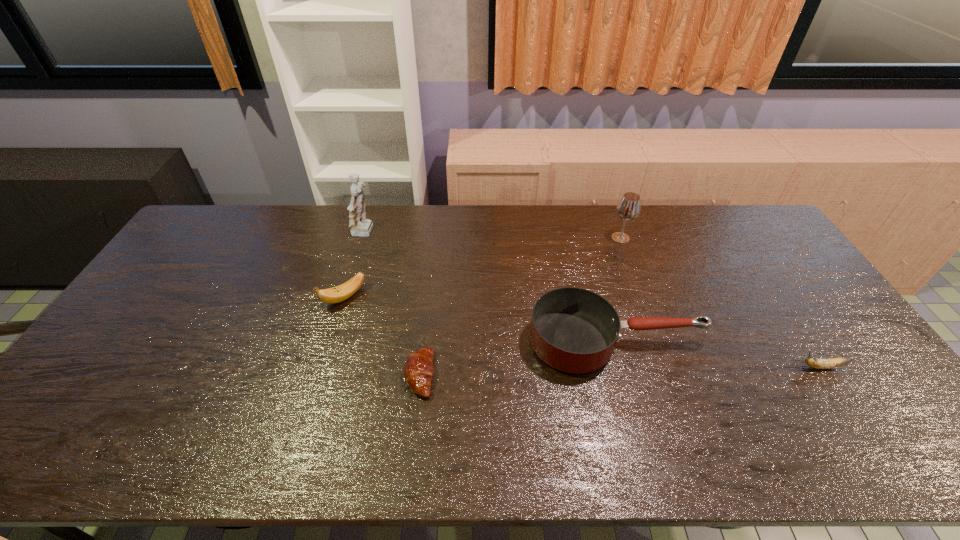
The image size is (960, 540). Find the location of `vacant space at the far edge of the desktop`. vacant space at the far edge of the desktop is located at coordinates (590, 209).

At what (x,y) coordinates should I click in order to perform the action: click on vacant space at the near edge of the desktop. Please return your answer as a coordinate pair (x, y). This screenshot has height=540, width=960. Looking at the image, I should click on (408, 440).

Find the location of a particular element. vacant space at the left edge is located at coordinates (194, 256).

Locate an element on the screen. vacant space at the right edge of the desktop is located at coordinates (838, 402).

This screenshot has height=540, width=960. I want to click on vacant region at the far left corner of the desktop, so click(x=246, y=216).

At what (x,y) coordinates should I click in order to perform the action: click on free space that is in between the tallest object and the taller banana. Please return your answer as a coordinate pair (x, y). Image resolution: width=960 pixels, height=540 pixels. Looking at the image, I should click on (355, 265).

This screenshot has width=960, height=540. In order to click on vacant space in between the fourth object from right to left and the nearer banana in this screenshot , I will do point(620,371).

What are the coordinates of `free spot between the shortest object and the rightmost object` in the screenshot? It's located at (620, 371).

Locate an element on the screen. The width and height of the screenshot is (960, 540). vacant space that is in between the pan and the tallest object is located at coordinates (491, 287).

Find the location of a particular element. The image size is (960, 540). unoccupied position between the pan and the crescent roll is located at coordinates (517, 358).